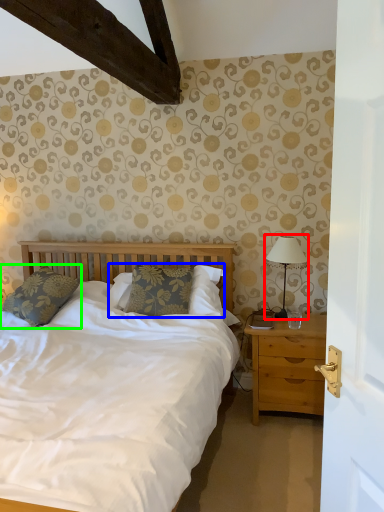
Question: Based on their relative distances, which object is farther from bedside lamp (highlighted by a red box)? Choose from pillow (highlighted by a blue box) and pillow (highlighted by a green box).

Choices:
 (A) pillow
 (B) pillow

Answer: (B)